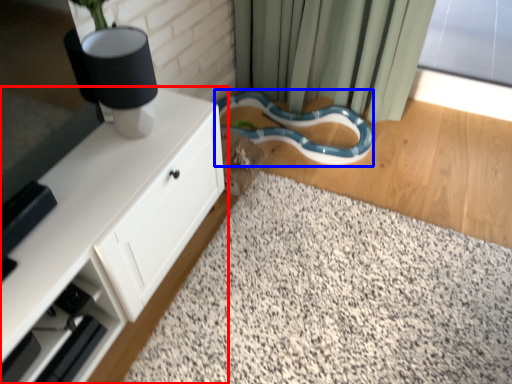
Question: Which object appears farthest to the camera in this image, cabinetry (highlighted by a red box) or snake (highlighted by a blue box)?

Choices:
 (A) cabinetry
 (B) snake

Answer: (B)